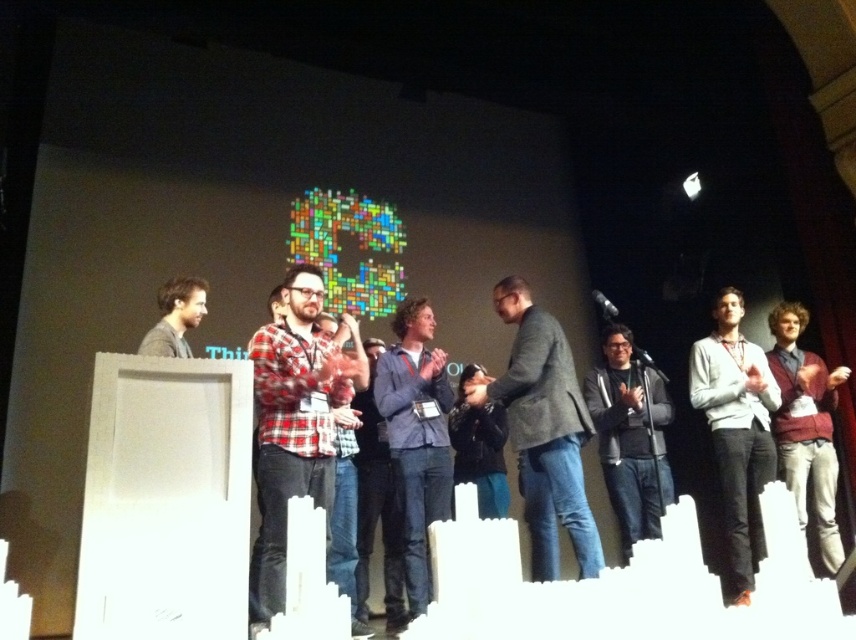
Is maroon sweater at right positioned behind black metallic microphone at center?

No, it is in front of black metallic microphone at center.

Is maroon sweater at right below black metallic microphone at center?

Indeed, maroon sweater at right is positioned under black metallic microphone at center.

Describe the element at coordinates (806, 426) in the screenshot. I see `maroon sweater at right` at that location.

The width and height of the screenshot is (856, 640). Identify the location of maroon sweater at right. (806, 426).

This screenshot has height=640, width=856. What do you see at coordinates (806, 426) in the screenshot?
I see `maroon sweater at right` at bounding box center [806, 426].

Where is `maroon sweater at right`? The height and width of the screenshot is (640, 856). maroon sweater at right is located at coordinates (806, 426).

Looking at this image, which of these two, gray sweater at center or maroon sweater at right, stands taller?

gray sweater at center

Between point (758, 376) and point (788, 445), which one is positioned in front?

Point (758, 376)

At what (x,y) coordinates should I click in order to perform the action: click on gray sweater at center. Please return your answer as a coordinate pair (x, y). This screenshot has height=640, width=856. Looking at the image, I should click on (736, 428).

Locate an element on the screen. This screenshot has height=640, width=856. gray sweater at center is located at coordinates point(736,428).